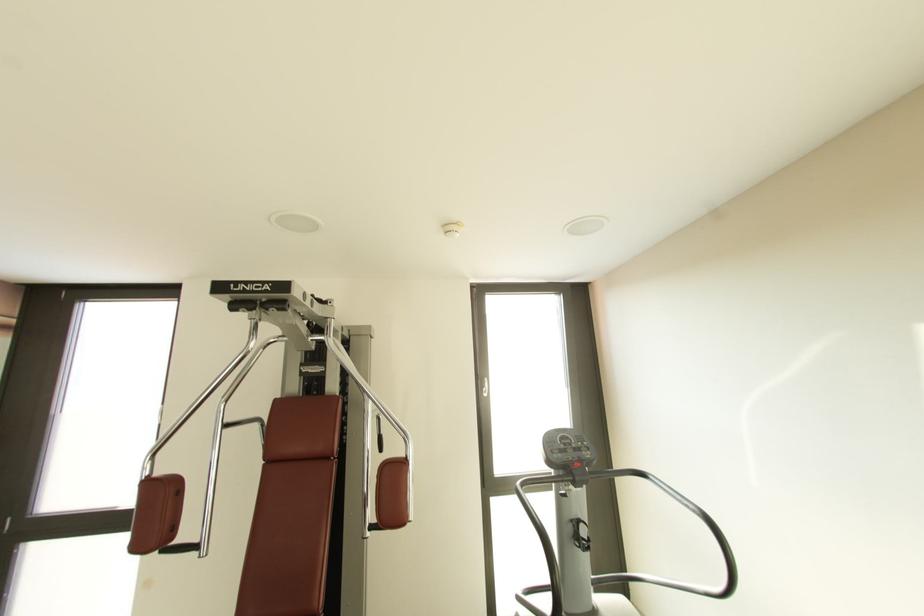
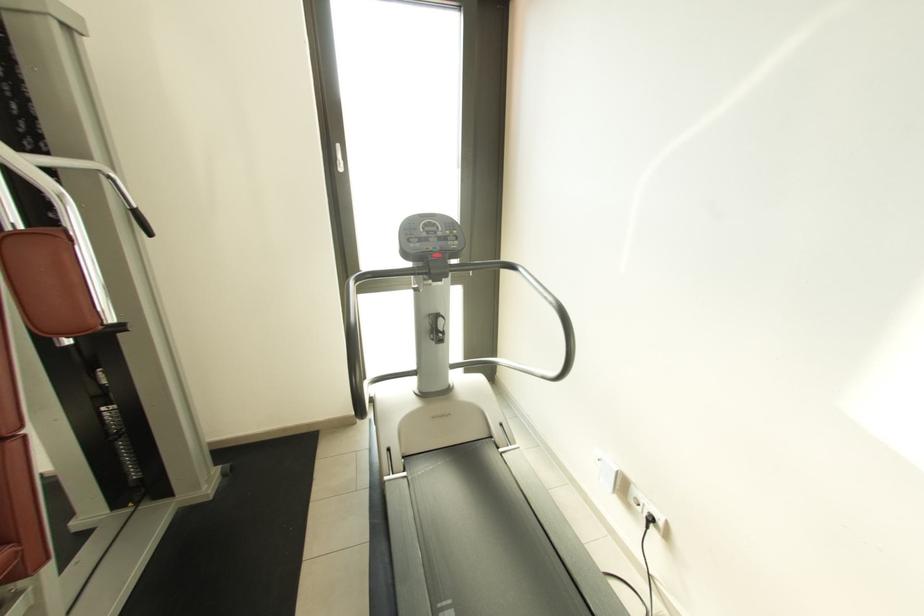
The point at (490, 395) is marked in the first image. Where is the corresponding point in the second image?

(345, 171)